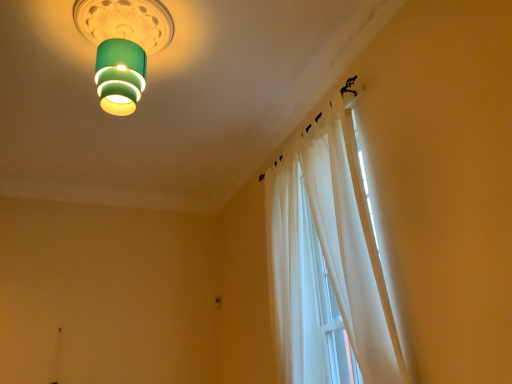
Question: Is green matte lampshade at upper center inside the boundaries of white sheer curtain at upper right, or outside?

Choices:
 (A) inside
 (B) outside

Answer: (B)

Question: Considering the relative positions of green matte lampshade at upper center and white sheer curtain at upper right in the image provided, is green matte lampshade at upper center to the left or to the right of white sheer curtain at upper right?

Choices:
 (A) right
 (B) left

Answer: (B)

Question: Considering the positions of green matte lampshade at upper center and white sheer curtain at upper right in the image, is green matte lampshade at upper center wider or thinner than white sheer curtain at upper right?

Choices:
 (A) wide
 (B) thin

Answer: (A)

Question: Considering their positions, is white sheer curtain at upper right located in front of or behind green matte lampshade at upper center?

Choices:
 (A) front
 (B) behind

Answer: (A)

Question: Is white sheer curtain at upper right taller or shorter than green matte lampshade at upper center?

Choices:
 (A) tall
 (B) short

Answer: (A)

Question: Considering the relative positions of white sheer curtain at upper right and green matte lampshade at upper center in the image provided, is white sheer curtain at upper right to the left or to the right of green matte lampshade at upper center?

Choices:
 (A) left
 (B) right

Answer: (B)

Question: Which is correct: white sheer curtain at upper right is inside green matte lampshade at upper center, or outside of it?

Choices:
 (A) inside
 (B) outside

Answer: (B)